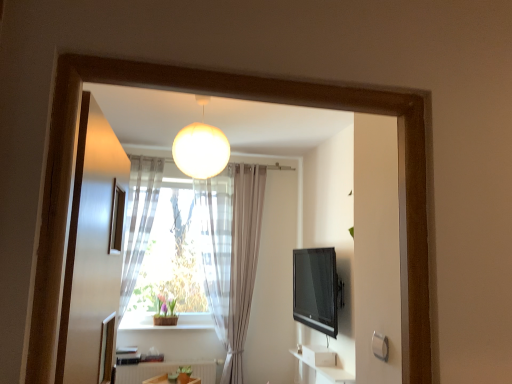
Measure the distance between transparent glass screen door at center and camera.

They are 88.63 centimeters apart.

The image size is (512, 384). In order to click on black glossy tv at right in this screenshot , I will do `click(316, 289)`.

Where is `matte glass globe at upper center`? matte glass globe at upper center is located at coordinates (201, 148).

The height and width of the screenshot is (384, 512). Find the location of `radiator below the transparent glass screen door at center (from the image's perspective)`. radiator below the transparent glass screen door at center (from the image's perspective) is located at coordinates (165, 371).

Which of these two, transparent glass screen door at center or white matte radiator at lower center, stands shorter?

Standing shorter between the two is white matte radiator at lower center.

Which point is more distant from viewer, (79, 377) or (214, 376)?

The point (214, 376) is behind.

Does point (68, 290) appear closer or farther from the camera than point (161, 174)?

Point (68, 290).

Is transparent glass screen door at center oriented towards translucent fabric curtain at center, the second curtain in the right-to-left sequence?

No, transparent glass screen door at center is not turned towards translucent fabric curtain at center, the second curtain in the right-to-left sequence.

Is transparent glass screen door at center positioned before translucent fabric curtain at center, which is counted as the first curtain, starting from the left?

Yes, it is.

Between transparent glass screen door at center and translucent fabric curtain at center, which is counted as the first curtain, starting from the left, which one appears on the right side from the viewer's perspective?

From the viewer's perspective, transparent glass screen door at center appears more on the right side.

Visually, is white matte radiator at lower center positioned to the left or to the right of translucent fabric curtain at center, which is counted as the first curtain, starting from the left?

Clearly, white matte radiator at lower center is on the right of translucent fabric curtain at center, which is counted as the first curtain, starting from the left, in the image.

Considering the positions of point (117, 377) and point (148, 162), is point (117, 377) closer or farther from the camera than point (148, 162)?

Point (117, 377) is closer to the camera than point (148, 162).

From the image's perspective, is white matte radiator at lower center above translucent fabric curtain at center, the second curtain in the right-to-left sequence?

No, from the image's perspective, white matte radiator at lower center is not on top of translucent fabric curtain at center, the second curtain in the right-to-left sequence.

Is white matte radiator at lower center closer to the viewer compared to translucent fabric curtain at center, which is counted as the first curtain, starting from the left?

No, it is not.

Is black glossy tv at right at the back of white matte radiator at lower center?

white matte radiator at lower center is not turned away from black glossy tv at right.

Which is closer to the camera, (199, 363) or (294, 317)?

The point (199, 363) is closer to the camera.

Is white matte radiator at lower center far away from black glossy tv at right?

Yes, white matte radiator at lower center and black glossy tv at right are quite far apart.

Consider the image. From a real-world perspective, between white matte radiator at lower center and black glossy tv at right, who is vertically higher?

black glossy tv at right.

Which is farther from the camera, (x=239, y=205) or (x=203, y=110)?

The point (x=239, y=205) is farther from the camera.

Based on the photo, is white sheer curtain at center, which is counted as the 2th curtain, starting from the left, beside matte glass globe at upper center?

No, white sheer curtain at center, which is counted as the 2th curtain, starting from the left, is not with matte glass globe at upper center.

Is matte glass globe at upper center surrounded by white sheer curtain at center, which is counted as the 2th curtain, starting from the left?

No.

Does transparent glass screen door at center have a greater height compared to matte glass globe at upper center?

Yes.

Is there a large distance between transparent glass screen door at center and matte glass globe at upper center?

That's right, there is a large distance between transparent glass screen door at center and matte glass globe at upper center.

Is transparent glass screen door at center aimed at matte glass globe at upper center?

No, transparent glass screen door at center is not facing towards matte glass globe at upper center.

Is transparent glass screen door at center wider or thinner than black glossy tv at right?

Clearly, transparent glass screen door at center has more width compared to black glossy tv at right.

Is transparent glass screen door at center in front of or behind black glossy tv at right in the image?

transparent glass screen door at center is positioned closer to the viewer than black glossy tv at right.

Is black glossy tv at right completely or partially inside transparent glass screen door at center?

No, black glossy tv at right is not surrounded by transparent glass screen door at center.

Is transparent glass screen door at center to the right of black glossy tv at right from the viewer's perspective?

In fact, transparent glass screen door at center is to the left of black glossy tv at right.

Where is `screen door on the right side of white matte radiator at lower center`? screen door on the right side of white matte radiator at lower center is located at coordinates (93, 251).

From the transparent glass screen door at center, count 1st curtains backward and point to it. Please provide its 2D coordinates.

[(139, 220)]

Estimate the real-world distances between objects in this image. Which object is further from translucent fabric curtain at center, which is counted as the first curtain, starting from the left, transparent glass screen door at center or white sheer curtain at center, the first curtain when ordered from right to left?

transparent glass screen door at center is further to translucent fabric curtain at center, which is counted as the first curtain, starting from the left.

Considering their positions, is transparent glass screen door at center positioned further to white sheer curtain at center, which is counted as the 2th curtain, starting from the left, than matte glass globe at upper center?

transparent glass screen door at center.

Estimate the real-world distances between objects in this image. Which object is further from white matte radiator at lower center, black glossy tv at right or matte glass globe at upper center?

Based on the image, matte glass globe at upper center appears to be further to white matte radiator at lower center.

Based on the photo, when comparing their distances from white sheer curtain at center, the first curtain when ordered from right to left, does translucent fabric curtain at center, which is counted as the first curtain, starting from the left, or matte glass globe at upper center seem further?

Among the two, matte glass globe at upper center is located further to white sheer curtain at center, the first curtain when ordered from right to left.

Considering their positions, is translucent fabric curtain at center, which is counted as the first curtain, starting from the left, positioned closer to black glossy tv at right than white sheer curtain at center, which is counted as the 2th curtain, starting from the left?

white sheer curtain at center, which is counted as the 2th curtain, starting from the left, lies closer to black glossy tv at right than the other object.

Looking at the image, which one is located further to white sheer curtain at center, which is counted as the 2th curtain, starting from the left, transparent glass screen door at center or translucent fabric curtain at center, which is counted as the first curtain, starting from the left?

transparent glass screen door at center lies further to white sheer curtain at center, which is counted as the 2th curtain, starting from the left, than the other object.

Estimate the real-world distances between objects in this image. Which object is closer to matte glass globe at upper center, transparent glass screen door at center or black glossy tv at right?

The object closer to matte glass globe at upper center is transparent glass screen door at center.

Considering their positions, is black glossy tv at right positioned further to translucent fabric curtain at center, the second curtain in the right-to-left sequence, than transparent glass screen door at center?

transparent glass screen door at center is positioned further to the anchor translucent fabric curtain at center, the second curtain in the right-to-left sequence.

The height and width of the screenshot is (384, 512). Find the location of `curtain between translucent fabric curtain at center, the second curtain in the right-to-left sequence, and white matte radiator at lower center in the up-down direction`. curtain between translucent fabric curtain at center, the second curtain in the right-to-left sequence, and white matte radiator at lower center in the up-down direction is located at coordinates (231, 253).

Image resolution: width=512 pixels, height=384 pixels. What are the coordinates of `lamp between transparent glass screen door at center and black glossy tv at right from front to back` in the screenshot? It's located at (201, 148).

You are a GUI agent. You are given a task and a screenshot of the screen. Output one action in this format:
    pyautogui.click(x=<x>, y=<y>)
    Task: Click on the lamp between translucent fabric curtain at center, which is counted as the first curtain, starting from the left, and black glossy tv at right from left to right
    
    Given the screenshot: What is the action you would take?
    pyautogui.click(x=201, y=148)

Find the location of a particular element. The height and width of the screenshot is (384, 512). lamp between transparent glass screen door at center and white sheer curtain at center, the first curtain when ordered from right to left, in the front-back direction is located at coordinates (201, 148).